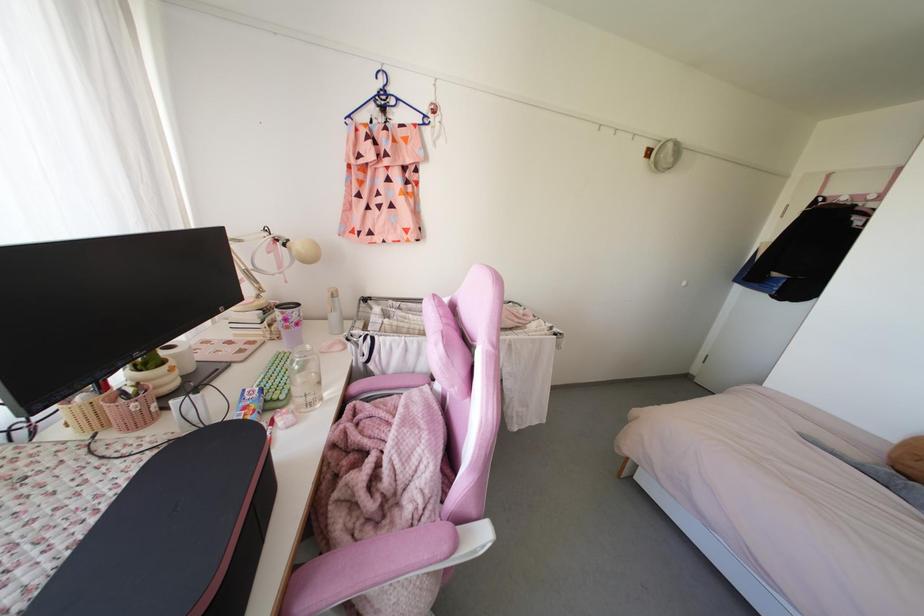
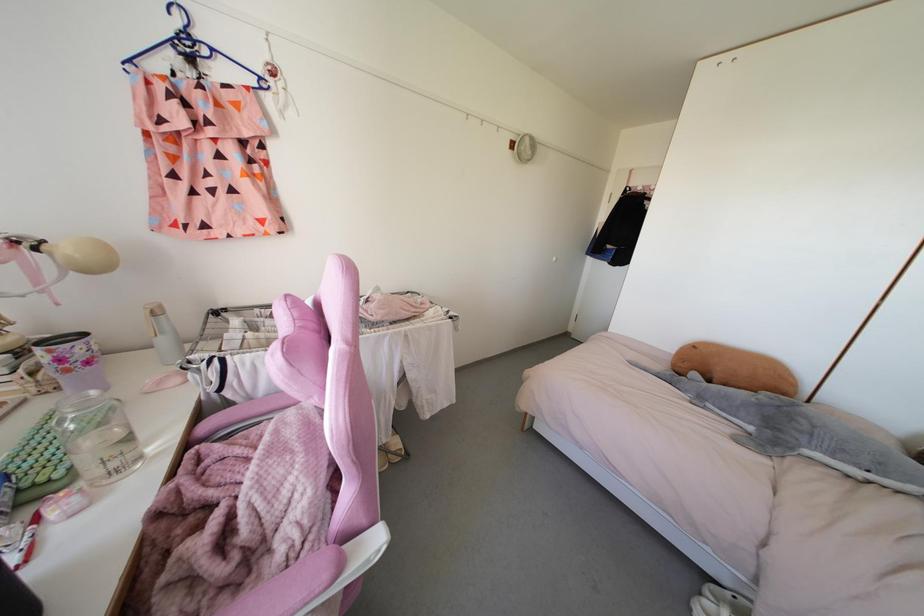
Question: How did the camera likely rotate?

Choices:
 (A) Left
 (B) Right
 (C) Up
 (D) Down

Answer: (B)